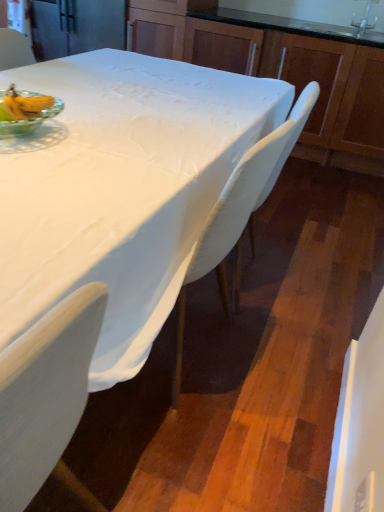
Find the location of `vacant space to the right of green glass bowl at upper left`. vacant space to the right of green glass bowl at upper left is located at coordinates (103, 144).